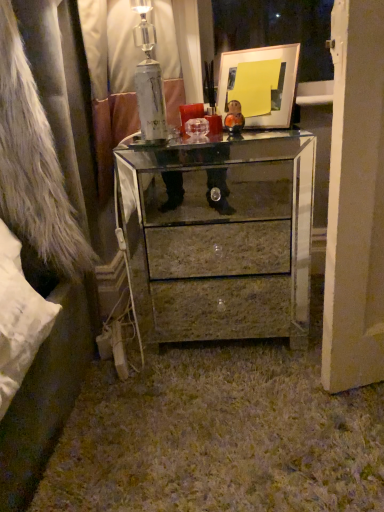
Question: Is mirrored glass chest of drawers at center positioned before brown marble drawer at center?

Choices:
 (A) yes
 (B) no

Answer: (A)

Question: Can you confirm if mirrored glass chest of drawers at center is shorter than brown marble drawer at center?

Choices:
 (A) yes
 (B) no

Answer: (B)

Question: From a real-world perspective, is mirrored glass chest of drawers at center beneath brown marble drawer at center?

Choices:
 (A) no
 (B) yes

Answer: (A)

Question: Is mirrored glass chest of drawers at center facing towards brown marble drawer at center?

Choices:
 (A) yes
 (B) no

Answer: (B)

Question: Is mirrored glass chest of drawers at center turned away from brown marble drawer at center?

Choices:
 (A) yes
 (B) no

Answer: (A)

Question: Is mirrored glass chest of drawers at center wider than brown marble drawer at center?

Choices:
 (A) no
 (B) yes

Answer: (B)

Question: Is matte gold picture frame at upper center positioned before brown marble drawer at center?

Choices:
 (A) yes
 (B) no

Answer: (A)

Question: From a real-world perspective, does matte gold picture frame at upper center sit lower than brown marble drawer at center?

Choices:
 (A) no
 (B) yes

Answer: (A)

Question: Does matte gold picture frame at upper center touch brown marble drawer at center?

Choices:
 (A) no
 (B) yes

Answer: (A)

Question: Does matte gold picture frame at upper center have a larger size compared to brown marble drawer at center?

Choices:
 (A) yes
 (B) no

Answer: (B)

Question: From the image's perspective, is matte gold picture frame at upper center below brown marble drawer at center?

Choices:
 (A) no
 (B) yes

Answer: (A)

Question: Is matte gold picture frame at upper center outside of brown marble drawer at center?

Choices:
 (A) yes
 (B) no

Answer: (A)

Question: From the image's perspective, is brown marble drawer at center located above mirrored glass chest of drawers at center?

Choices:
 (A) no
 (B) yes

Answer: (A)